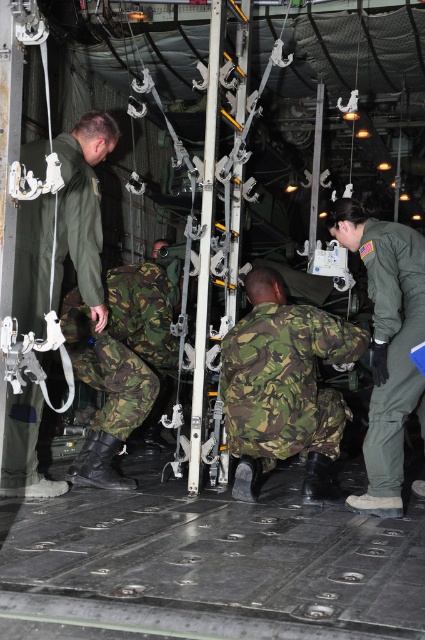
Question: Which object is the closest to the camouflage fabric uniform at center?

Choices:
 (A) camo fabric pants at lower center
 (B) green camouflage uniform at left
 (C) green matte flight suit at right

Answer: (C)

Question: Does green camouflage uniform at left appear over green matte flight suit at right?

Choices:
 (A) no
 (B) yes

Answer: (B)

Question: Can you confirm if green camouflage uniform at left is positioned above camouflage fabric uniform at center?

Choices:
 (A) no
 (B) yes

Answer: (B)

Question: Can you confirm if camouflage fabric uniform at center is wider than green matte flight suit at right?

Choices:
 (A) no
 (B) yes

Answer: (B)

Question: Which point is farther to the camera?

Choices:
 (A) green camouflage uniform at left
 (B) green matte flight suit at right
 (C) camo fabric pants at lower center

Answer: (C)

Question: Which of the following is the closest to the observer?

Choices:
 (A) (410, 259)
 (B) (48, 240)
 (C) (226, 384)
 (D) (87, 316)

Answer: (A)